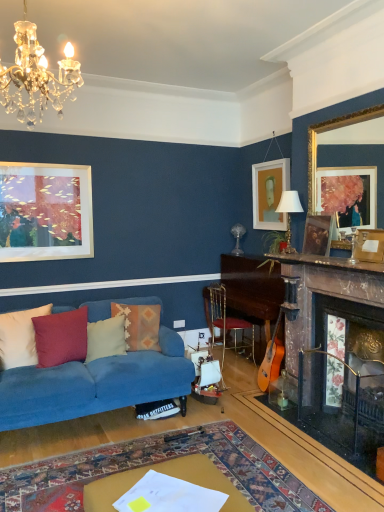
Question: From the image's perspective, is gold-framed mirror at upper right, which ranks as the 4th picture frame in back-to-front order, above or below blue fabric couch at lower left?

Choices:
 (A) above
 (B) below

Answer: (A)

Question: In the image, is gold-framed mirror at upper right, the 1th picture frame viewed from the front, positioned in front of or behind blue fabric couch at lower left?

Choices:
 (A) behind
 (B) front

Answer: (A)

Question: Based on their relative distances, which object is nearer to the white paper at lower center, which appears as the second table when viewed from the right?

Choices:
 (A) blue fabric couch at lower left
 (B) gold-framed mirror at upper right, which ranks as the 4th picture frame in back-to-front order
 (C) wooden fireplace at right
 (D) textured woolen pillow at center, the 1th pillow positioned from the right
 (E) wooden picture frame at right, which is counted as the 3th picture frame, starting from the back

Answer: (A)

Question: Which object is the closest to the light blue fabric pillow at center, which is the third pillow from left to right?

Choices:
 (A) wooden mantle at upper center
 (B) gold metallic lampshade at upper center
 (C) wooden table at center, placed as the 1th table when sorted from back to front
 (D) textured woolen pillow at center, which appears as the fourth pillow when viewed from the left
 (E) wooden fireplace at right

Answer: (D)